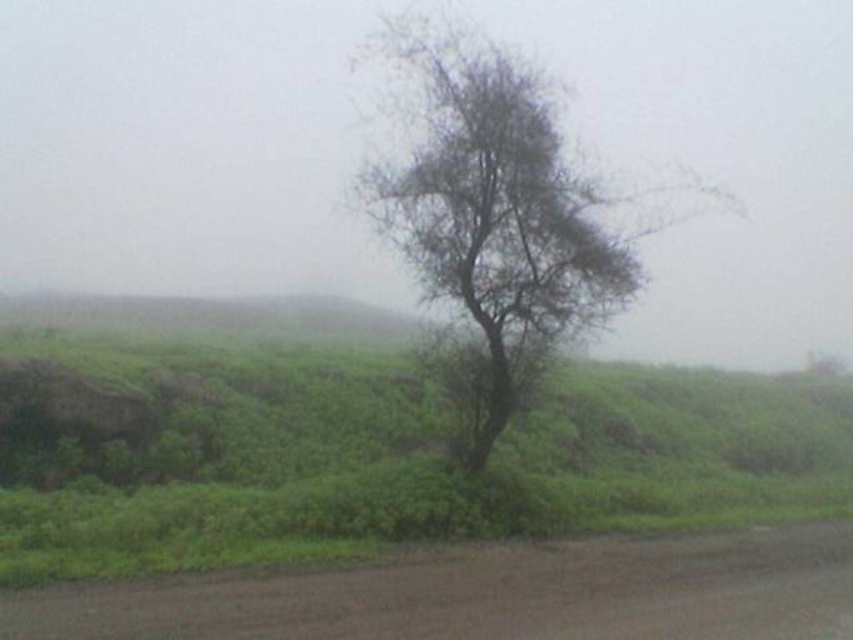
Between green leafy tree at center and brown dirt track at lower center, which one has more height?

green leafy tree at center is taller.

In the scene shown: Does green leafy tree at center appear on the right side of brown dirt track at lower center?

Correct, you'll find green leafy tree at center to the right of brown dirt track at lower center.

Where is `green leafy tree at center`? The width and height of the screenshot is (853, 640). green leafy tree at center is located at coordinates (496, 216).

At what (x,y) coordinates should I click in order to perform the action: click on green leafy tree at center. Please return your answer as a coordinate pair (x, y). Image resolution: width=853 pixels, height=640 pixels. Looking at the image, I should click on (496, 216).